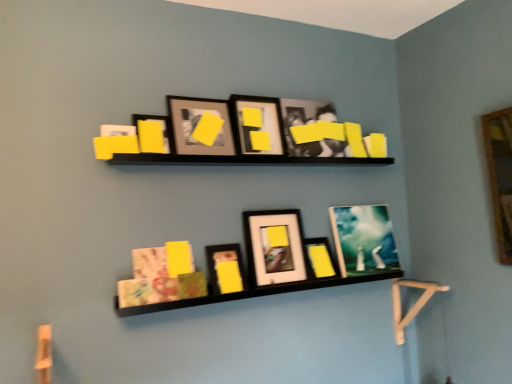
Question: Is matte glass picture frame at upper center, acting as the 8th picture frame starting from the left, inside matte black picture frame at upper center, which is the seventh picture frame from right to left?

Choices:
 (A) yes
 (B) no

Answer: (B)

Question: Is matte black picture frame at upper center, which appears as the second picture frame when viewed from the left, taller than matte glass picture frame at upper center, which is the first picture frame from right to left?

Choices:
 (A) yes
 (B) no

Answer: (B)

Question: From a real-world perspective, is matte black picture frame at upper center, which is the seventh picture frame from right to left, positioned under matte glass picture frame at upper center, which is the first picture frame from right to left, based on gravity?

Choices:
 (A) no
 (B) yes

Answer: (A)

Question: Is matte black picture frame at upper center, which is the seventh picture frame from right to left, placed right next to matte glass picture frame at upper center, which is the first picture frame from right to left?

Choices:
 (A) no
 (B) yes

Answer: (A)

Question: Is the position of matte black picture frame at upper center, which is the seventh picture frame from right to left, more distant than that of matte glass picture frame at upper center, which is the first picture frame from right to left?

Choices:
 (A) yes
 (B) no

Answer: (B)

Question: From the image's perspective, relative to black matte shelf at center, is matte black picture frame at upper center, which is the seventh picture frame from right to left, above or below?

Choices:
 (A) below
 (B) above

Answer: (B)

Question: From a real-world perspective, is matte black picture frame at upper center, which is the seventh picture frame from right to left, above or below black matte shelf at center?

Choices:
 (A) above
 (B) below

Answer: (A)

Question: Visually, is matte black picture frame at upper center, which appears as the second picture frame when viewed from the left, positioned to the left or to the right of black matte shelf at center?

Choices:
 (A) right
 (B) left

Answer: (B)

Question: Is matte black picture frame at upper center, which appears as the second picture frame when viewed from the left, wider or thinner than black matte shelf at center?

Choices:
 (A) thin
 (B) wide

Answer: (B)

Question: Is matte black picture frame at center, which is the 6th picture frame from right to left, in front of or behind matte black picture frame at upper center, the 5th picture frame from the right, in the image?

Choices:
 (A) behind
 (B) front

Answer: (B)

Question: Does point (243, 276) appear closer or farther from the camera than point (248, 135)?

Choices:
 (A) farther
 (B) closer

Answer: (B)

Question: From a real-world perspective, relative to matte black picture frame at upper center, placed as the 4th picture frame when sorted from left to right, is matte black picture frame at center, the third picture frame in the left-to-right sequence, vertically above or below?

Choices:
 (A) above
 (B) below

Answer: (B)

Question: Considering the positions of matte black picture frame at center, which is the 6th picture frame from right to left, and matte black picture frame at upper center, the 5th picture frame from the right, in the image, is matte black picture frame at center, which is the 6th picture frame from right to left, taller or shorter than matte black picture frame at upper center, the 5th picture frame from the right,?

Choices:
 (A) short
 (B) tall

Answer: (A)

Question: From their relative heights in the image, would you say matte black picture frame at center, the seventh picture frame positioned from the left, is taller or shorter than matte black picture frame at upper center, the first picture frame when ordered from left to right?

Choices:
 (A) tall
 (B) short

Answer: (B)

Question: From a real-world perspective, is matte black picture frame at center, the second picture frame from the right, above or below matte black picture frame at upper center, acting as the eighth picture frame starting from the right?

Choices:
 (A) above
 (B) below

Answer: (B)